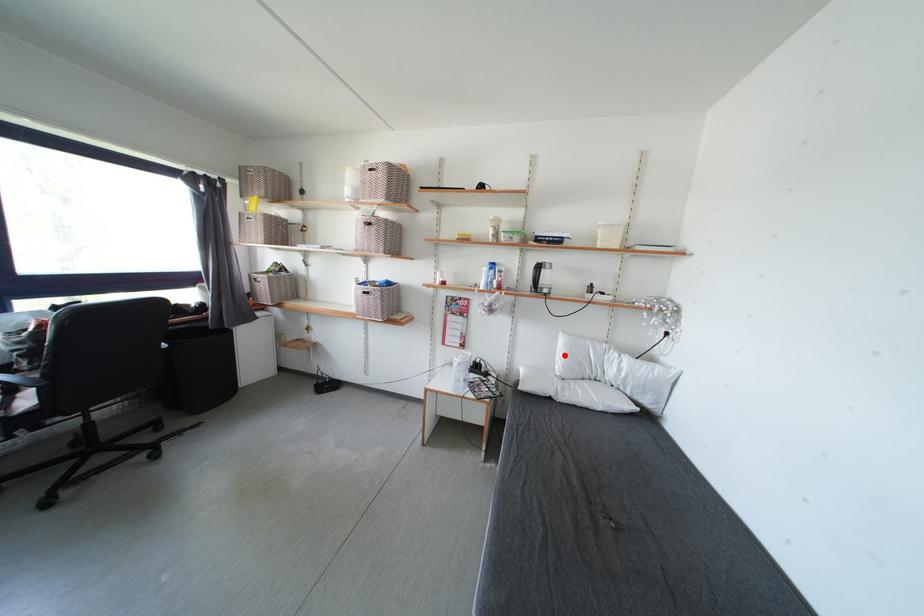
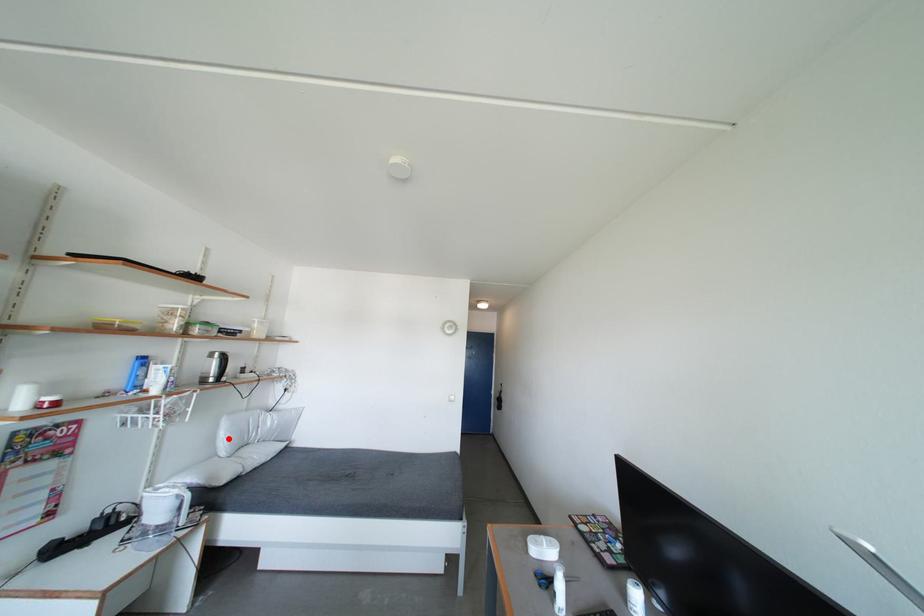
I am providing you with two images of the same scene from different viewpoints. A red point is marked on the first image and another point is marked on the second image. Is the marked point in image1 the same physical position as the marked point in image2?

Yes